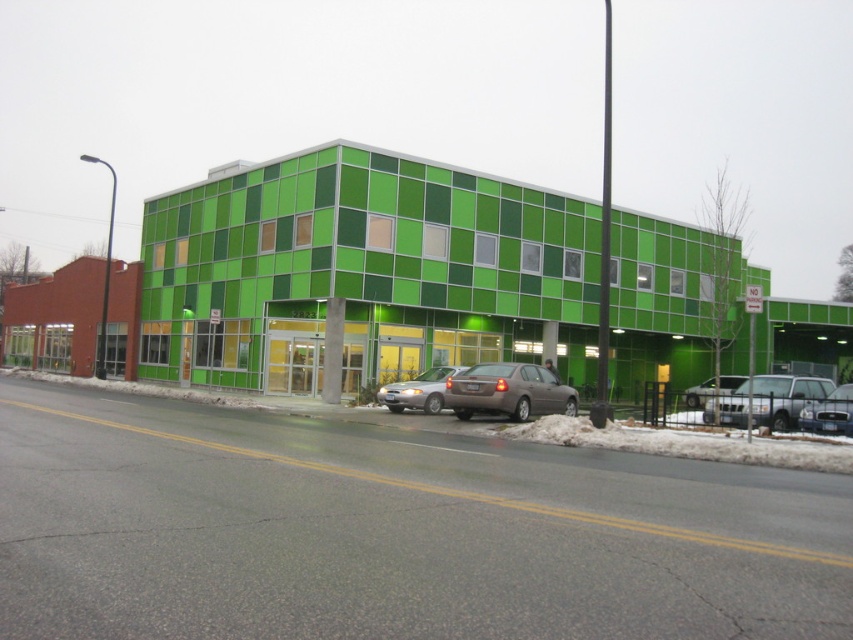
You are a delivery driver who needs to park your truck between the satin silver sedan at center and the shiny silver sedan at center. Your truck is 2.5 meters wide. Can you fit your truck between them?

The satin silver sedan at center is thinner than the shiny silver sedan at center, but the distance between them isn t specified. Without knowing the space between the two sedans, it s impossible to determine if the truck can fit.

You are standing at the point with coordinates (x=784, y=397). What object is located at this point?

The silver metallic sedan at right is located at the point with coordinates (x=784, y=397).

You are a delivery driver planning to park your truck between the shiny silver sedan at center and the matte silver sedan at center. Your truck is 20 feet long. Is there enough space between them to park your truck?

The shiny silver sedan at center and matte silver sedan at center are 28.07 feet apart. Since your truck is 20 feet long, there is sufficient space between them to park your truck as 28.07 feet is greater than 20 feet.